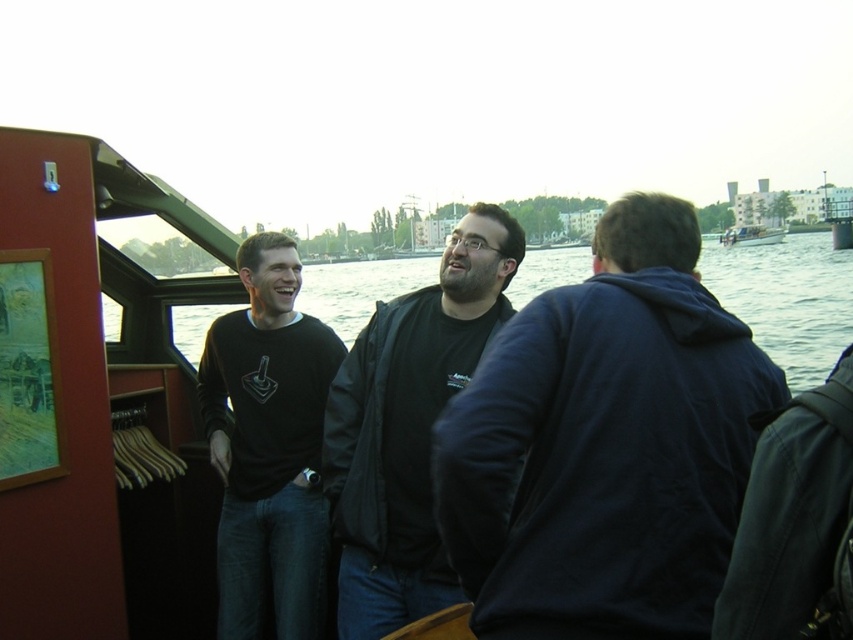
Question: Which object is positioned farthest from the clear water at center?

Choices:
 (A) black matte shirt at center
 (B) matte black jacket at center
 (C) dark blue hoodie at center

Answer: (B)

Question: Does dark blue hoodie at center have a greater width compared to matte black jacket at center?

Choices:
 (A) no
 (B) yes

Answer: (B)

Question: Which is farther from the matte black jacket at center?

Choices:
 (A) dark blue hoodie at center
 (B) black matte shirt at center
 (C) clear water at center

Answer: (C)

Question: Is matte black jacket at center smaller than clear water at center?

Choices:
 (A) no
 (B) yes

Answer: (B)

Question: Based on their relative distances, which object is farther from the white plastic boat at upper right?

Choices:
 (A) matte black jacket at center
 (B) black matte shirt at center

Answer: (A)

Question: Where is dark blue hoodie at center located in relation to white plastic boat at upper right in the image?

Choices:
 (A) below
 (B) above

Answer: (A)